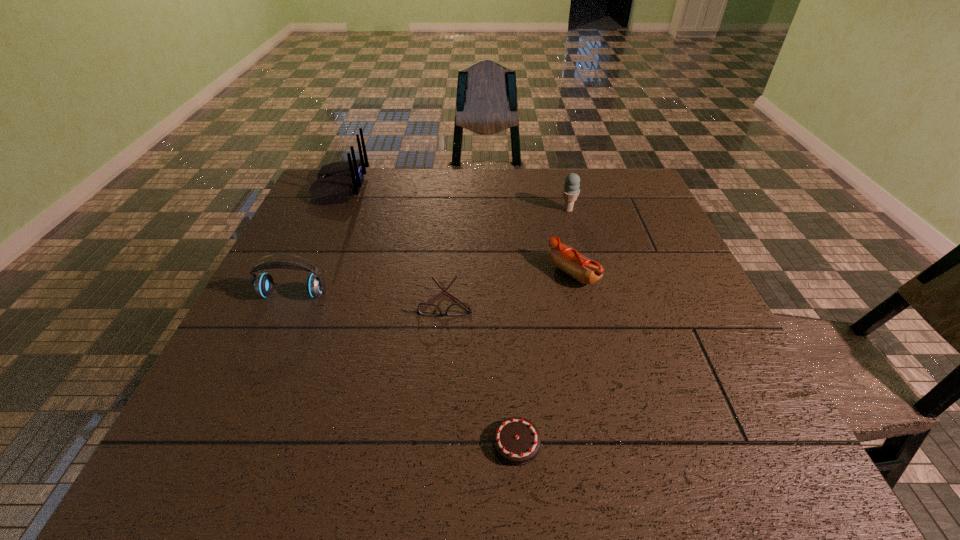
Where is `blank space located 0.220m on the ear cups of the headset`? This screenshot has width=960, height=540. blank space located 0.220m on the ear cups of the headset is located at coordinates (253, 384).

Where is `vacant space situated on the right of the sausage`? vacant space situated on the right of the sausage is located at coordinates (690, 273).

Locate an element on the screen. The image size is (960, 540). free location located 0.100m on the front-facing side of the second shortest object is located at coordinates (441, 353).

Find the location of a particular element. This screenshot has width=960, height=540. free space located on the back of the shortest object is located at coordinates (506, 278).

You are a GUI agent. You are given a task and a screenshot of the screen. Output one action in this format:
    pyautogui.click(x=<x>, y=<y>)
    Task: Click on the router located in the far edge section of the desktop
    The width and height of the screenshot is (960, 540).
    Given the screenshot: What is the action you would take?
    pyautogui.click(x=336, y=182)

Locate an element on the screen. The image size is (960, 540). ice cream at the far edge is located at coordinates (571, 190).

Find the location of a particular element. This screenshot has height=540, width=960. object positioned at the near edge is located at coordinates (516, 440).

Where is `router that is at the left edge`? router that is at the left edge is located at coordinates (336, 182).

The width and height of the screenshot is (960, 540). I want to click on headset that is at the left edge, so click(263, 284).

Locate an element on the screen. The height and width of the screenshot is (540, 960). object present at the far left corner is located at coordinates (336, 182).